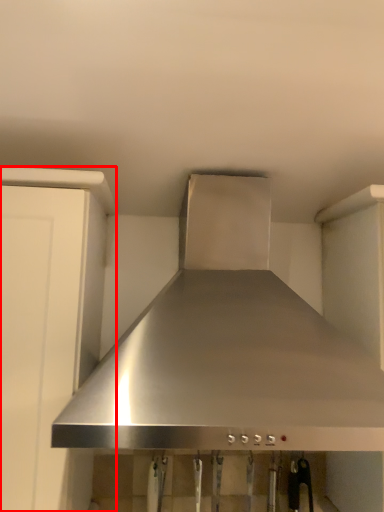
Question: From the image, what is the correct spatial relationship of cabinetry (annotated by the red box) in relation to home appliance?

Choices:
 (A) right
 (B) left

Answer: (B)